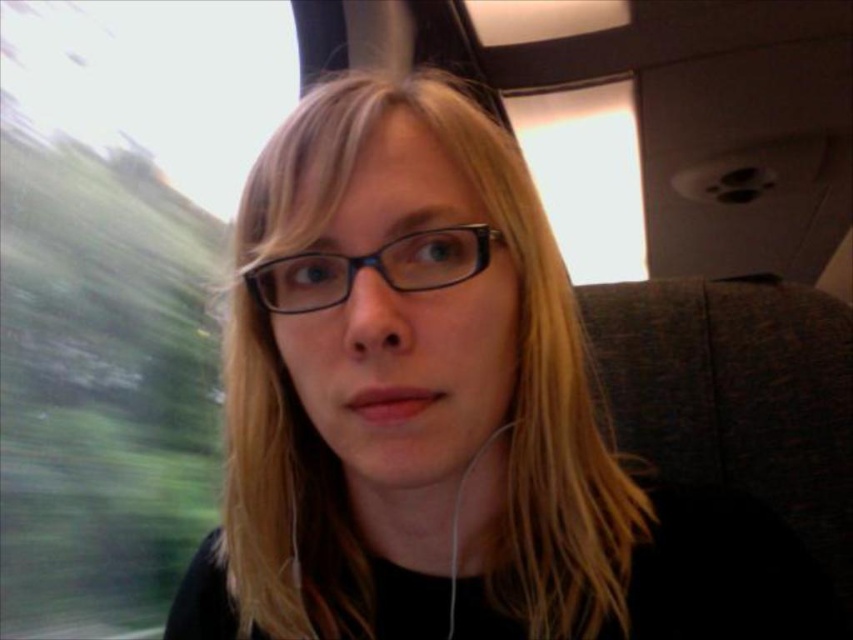
You are a passenger on a moving train and you want to place your blue plastic glasses at center on top of your white matte earphone at lower center. Is this possible based on their positions?

The blue plastic glasses at center is located above the white matte earphone at lower center, so placing the glasses on top of the earphone would not be possible since the glasses are already positioned above it and not directly over it.

You are a photographer taking a picture of the person in the train. You notice the blonde hair at center and the blue plastic glasses at center. Which object is closer to your camera lens?

The blonde hair at center is closer to the camera lens because it is further to the viewer than the blue plastic glasses at center.

You are a photographer trying to capture a portrait of the person in the train. You notice the blonde hair at center and the white matte earphone at lower center. Which object is wider in the image?

The blonde hair at center is wider than the white matte earphone at lower center according to the description.